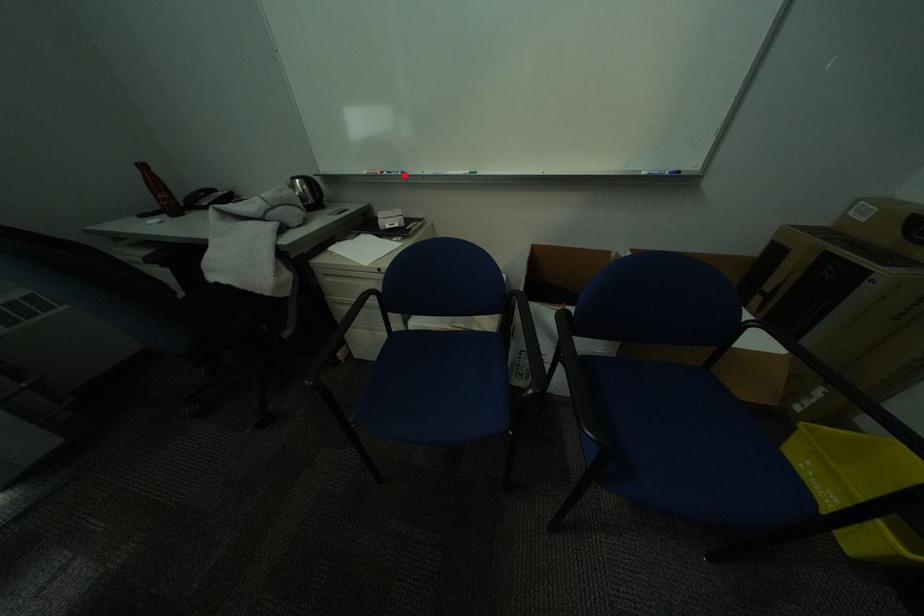
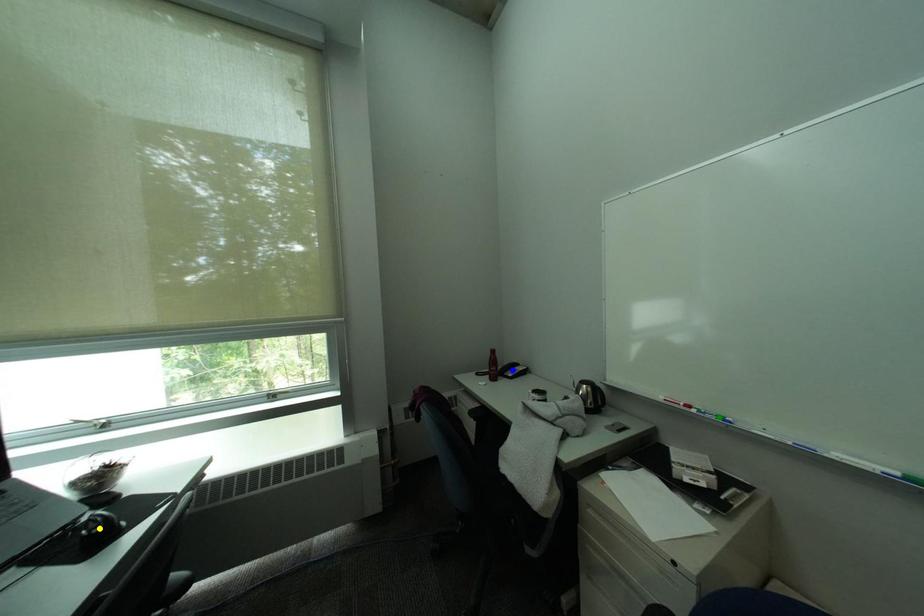
Question: I am providing you with two images of the same scene from different viewpoints. A red point is marked on the first image. You are given multiple points on the second image. In image 2, which mark is for the same physical point as the one in image 1?

Choices:
 (A) yellow point
 (B) green point
 (C) blue point

Answer: (B)